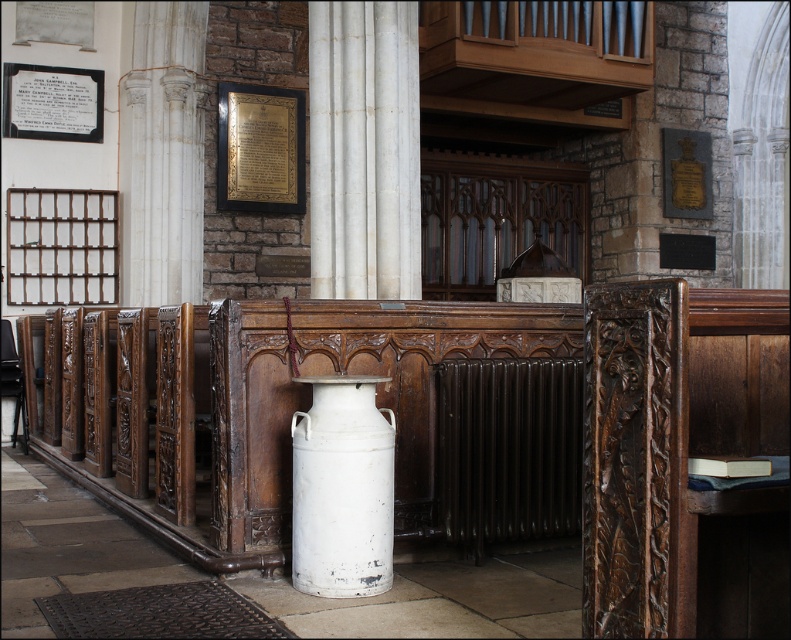
Question: Which object is farther from the camera taking this photo?

Choices:
 (A) dark brown radiator at center
 (B) white matte milk canister at center

Answer: (A)

Question: Does dark brown radiator at center have a greater width compared to white matte milk canister at center?

Choices:
 (A) no
 (B) yes

Answer: (B)

Question: Does dark brown radiator at center appear over white matte milk canister at center?

Choices:
 (A) no
 (B) yes

Answer: (B)

Question: Among these objects, which one is nearest to the camera?

Choices:
 (A) white matte milk canister at center
 (B) dark brown radiator at center

Answer: (A)

Question: Can you confirm if dark brown radiator at center is positioned above white matte milk canister at center?

Choices:
 (A) yes
 (B) no

Answer: (A)